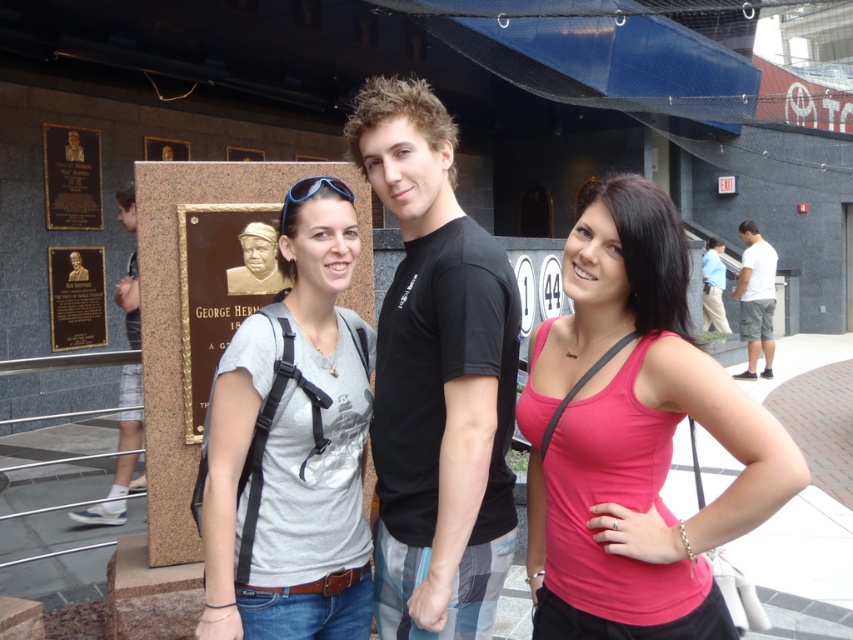
You are taking a photo of the plaque and notice two points in the image labeled as point [363,372] and point [709,292]. Which point will appear larger in the photo?

Point [363,372] is closer to the camera than point [709,292], so it will appear larger in the photo.